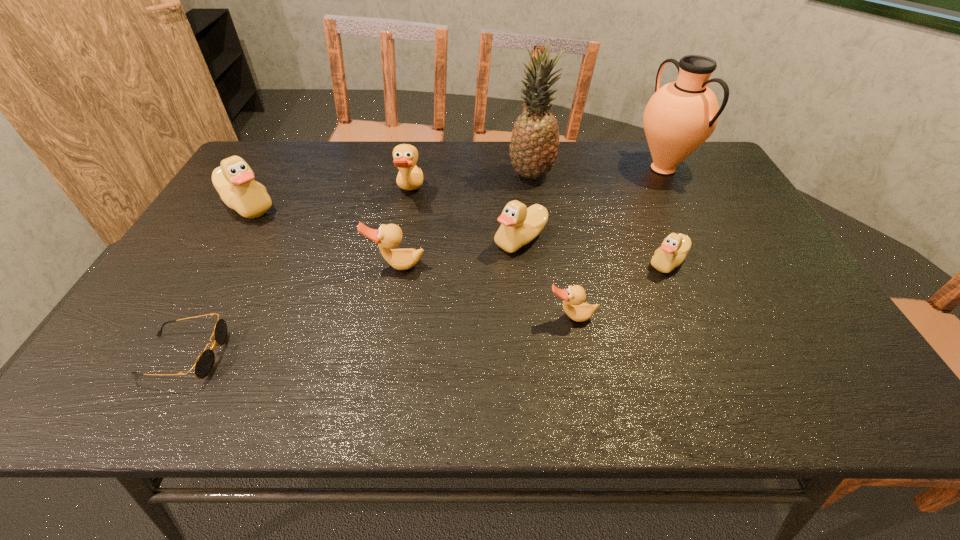
Identify the location of pineapple. This screenshot has width=960, height=540. (534, 144).

The width and height of the screenshot is (960, 540). What are the coordinates of `the eighth shortest object` in the screenshot? It's located at (680, 116).

At what (x,y) coordinates should I click in order to perform the action: click on the biggest beige duck. Please return your answer as a coordinate pair (x, y). Image resolution: width=960 pixels, height=540 pixels. Looking at the image, I should click on (234, 180).

Locate an element on the screen. This screenshot has height=540, width=960. the leftmost duck is located at coordinates (234, 180).

Locate an element on the screen. the farthest tan duck is located at coordinates (410, 177).

Find the location of a particular element. This screenshot has height=540, width=960. the second beige duck from left to right is located at coordinates (520, 225).

Where is `the second nearest tan duck`? This screenshot has width=960, height=540. the second nearest tan duck is located at coordinates (389, 236).

The height and width of the screenshot is (540, 960). Identify the location of the rightmost duck. (672, 252).

You are a GUI agent. You are given a task and a screenshot of the screen. Output one action in this format:
    pyautogui.click(x=<x>, y=<y>)
    Task: Click on the rightmost beige duck
    
    Given the screenshot: What is the action you would take?
    pyautogui.click(x=672, y=252)

Locate an element on the screen. The height and width of the screenshot is (540, 960). the nearest tan duck is located at coordinates (573, 297).